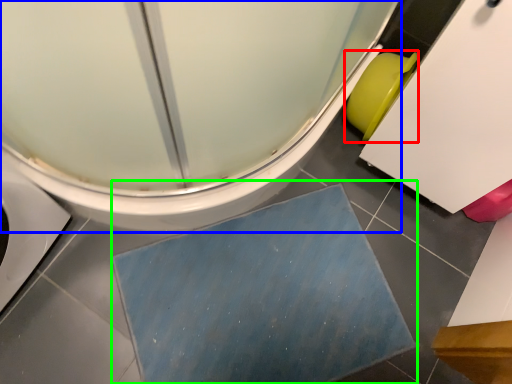
Question: Which object is positioned closest to toilet bowl (highlighted by a red box)? Select from toilet (highlighted by a blue box) and bath mat (highlighted by a green box).

Choices:
 (A) toilet
 (B) bath mat

Answer: (A)